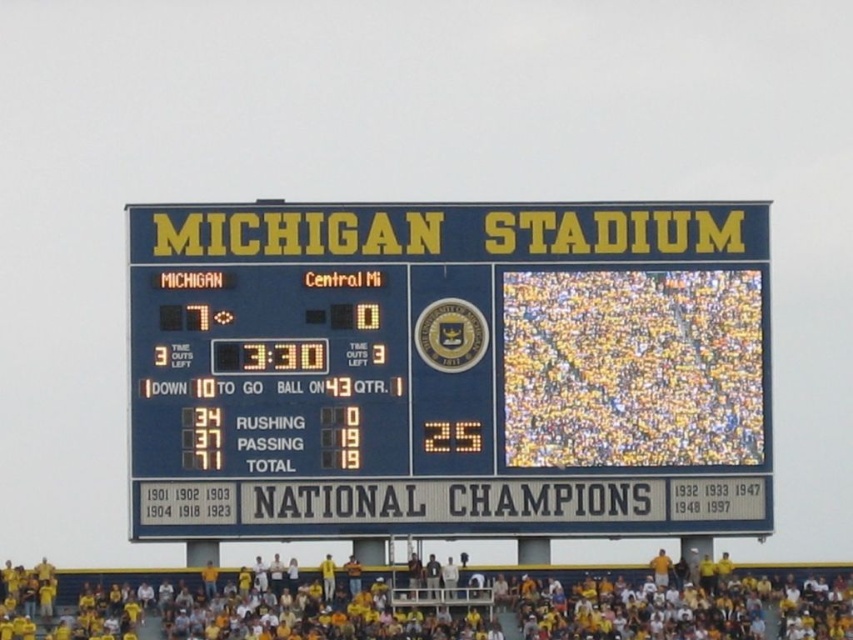
Is blue plastic scoreboard at center positioned before yellow fabric at lower center?

No, it is not.

Consider the image. Is blue plastic scoreboard at center to the right of yellow fabric at lower center from the viewer's perspective?

Correct, you'll find blue plastic scoreboard at center to the right of yellow fabric at lower center.

Locate an element on the screen. blue plastic scoreboard at center is located at coordinates (444, 364).